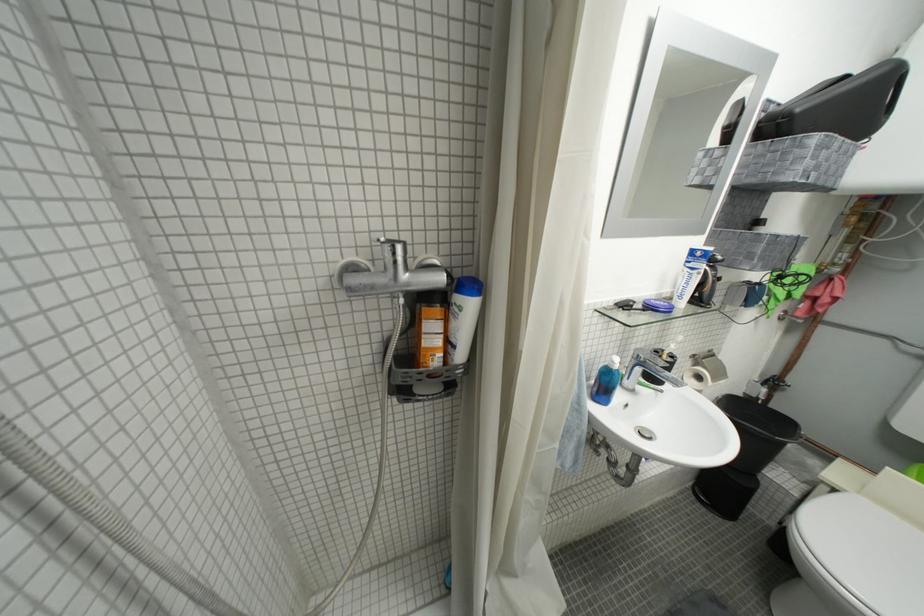
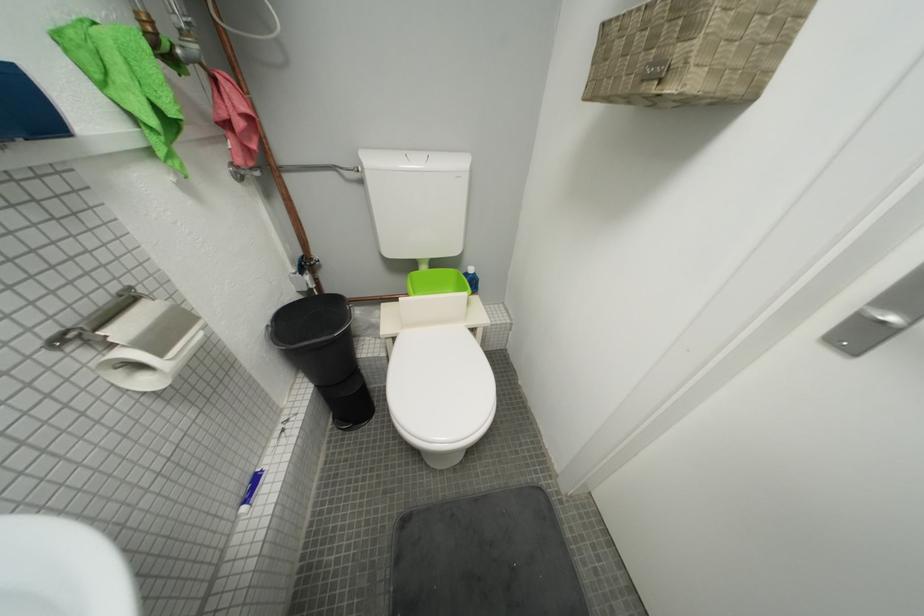
First-person continuous shooting, in which direction is the camera rotating?

The rotation direction of the camera is right-down.